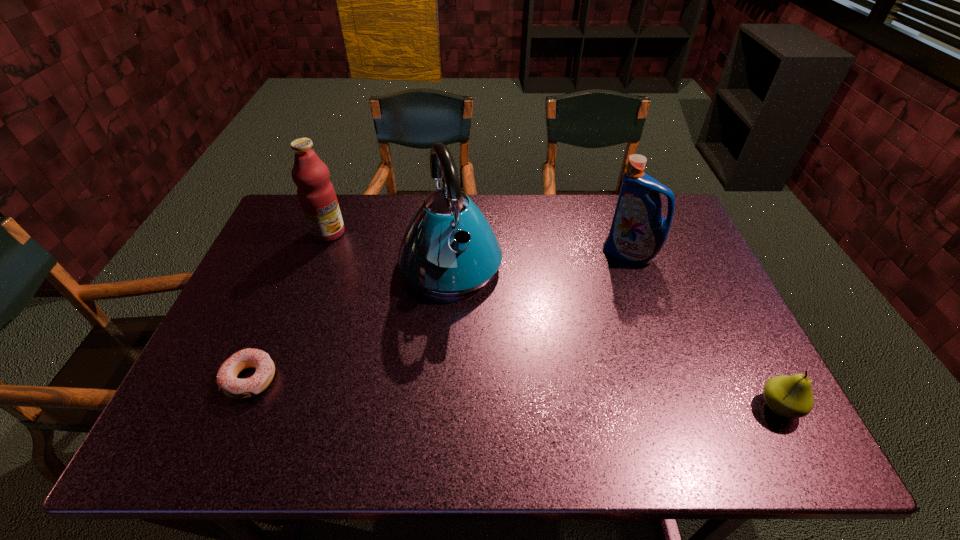
The height and width of the screenshot is (540, 960). Find the location of `vacant region located at the spout of the tallest object`. vacant region located at the spout of the tallest object is located at coordinates (481, 337).

Locate an element on the screen. The image size is (960, 540). vacant space located on the label of the fruit juice is located at coordinates (384, 280).

Locate an element on the screen. The width and height of the screenshot is (960, 540). vacant region located 0.110m on the label of the fruit juice is located at coordinates (357, 257).

In order to click on blank space located 0.310m on the label of the fruit juice in this screenshot , I will do `click(397, 291)`.

Locate an element on the screen. vacant space located on the label of the fourth object from left to right is located at coordinates (561, 314).

Where is `free point located 0.170m on the label of the fourth object from left to right`? The image size is (960, 540). free point located 0.170m on the label of the fourth object from left to right is located at coordinates (582, 294).

Locate an element on the screen. free space located 0.270m on the label of the fourth object from left to right is located at coordinates (561, 314).

This screenshot has height=540, width=960. I want to click on kettle that is positioned at the far edge, so click(x=449, y=249).

Where is `fruit juice that is at the far edge`? This screenshot has width=960, height=540. fruit juice that is at the far edge is located at coordinates (316, 194).

You are a GUI agent. You are given a task and a screenshot of the screen. Output one action in this format:
    pyautogui.click(x=<x>, y=<y>)
    Task: Click on the doughnut located at the near edge
    
    Given the screenshot: What is the action you would take?
    pos(227,381)